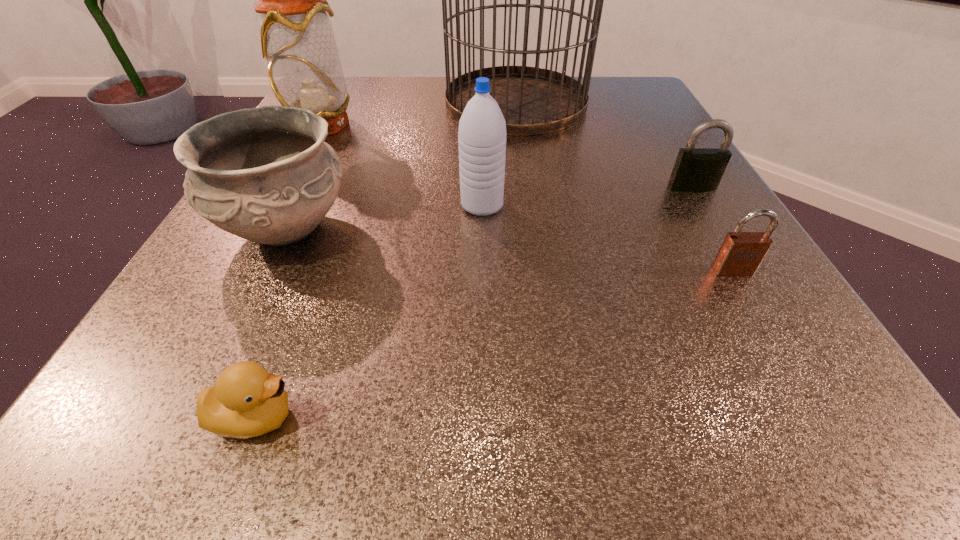
At what (x,y) coordinates should I click in order to perform the action: click on vacant area that lies between the shorter padlock and the third shortest object. Please return your answer as a coordinate pair (x, y). The image size is (960, 540). Looking at the image, I should click on (712, 229).

Locate an element on the screen. The height and width of the screenshot is (540, 960). vacant area that lies between the fourth shortest object and the nearer padlock is located at coordinates (510, 249).

You are a GUI agent. You are given a task and a screenshot of the screen. Output one action in this format:
    pyautogui.click(x=<x>, y=<y>)
    Task: Click on the free point between the birdcage and the farther padlock
    The image size is (960, 540).
    Given the screenshot: What is the action you would take?
    pyautogui.click(x=604, y=145)

This screenshot has width=960, height=540. What are the coordinates of `vacant area that lies between the fourth shortest object and the nearest object` in the screenshot? It's located at (272, 322).

The image size is (960, 540). I want to click on object that stands as the closest to the oil lamp, so click(265, 174).

Identify the location of object that stands as the fifth closest to the birdcage. (741, 253).

Image resolution: width=960 pixels, height=540 pixels. I want to click on vacant region that satisfies the following two spatial constraints: 1. on the back side of the pottery; 2. on the left side of the farther padlock, so click(306, 187).

Locate an element on the screen. vacant area in the image that satisfies the following two spatial constraints: 1. on the front side of the birdcage; 2. on the right side of the third shortest object is located at coordinates (527, 187).